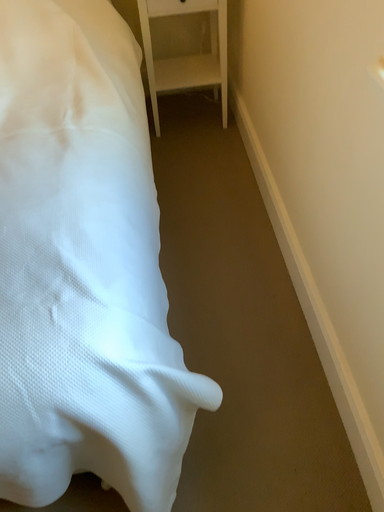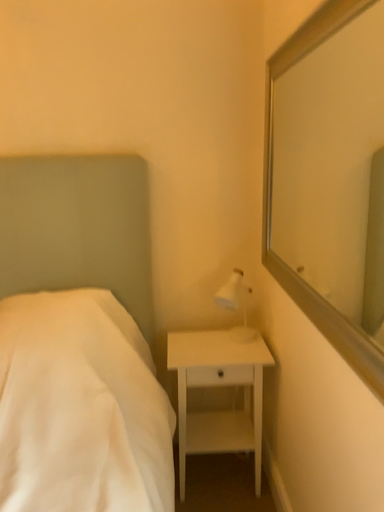
Question: Which way did the camera rotate in the video?

Choices:
 (A) rotated upward
 (B) rotated downward

Answer: (A)